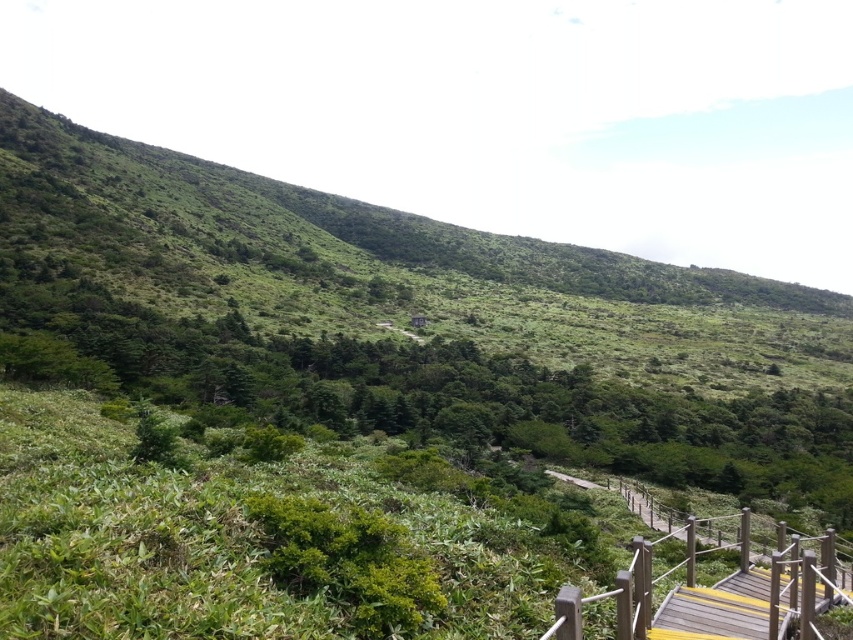
You are a hiker standing on the wooden pathway and notice two objects at the lower right corner of your view. Which object is positioned farther to the right between the wooden rail at lower right and the yellow painted wood at lower right?

The wooden rail at lower right is positioned farther to the right compared to the yellow painted wood at lower right according to the description.

You are a hiker carrying a backpack and need to walk along the wooden pathway bordered by railings. You notice two objects at the lower right corner of your path. Which one has a wider structure between the wooden rail at lower right and the yellow painted wood at lower right?

The wooden rail at lower right has a wider structure than the yellow painted wood at lower right.